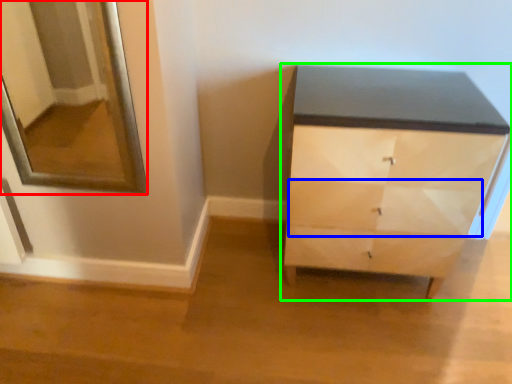
Question: Based on their relative distances, which object is nearer to mirror (highlighted by a red box)? Choose from drawer (highlighted by a blue box) and chest of drawers (highlighted by a green box).

Choices:
 (A) drawer
 (B) chest of drawers

Answer: (B)